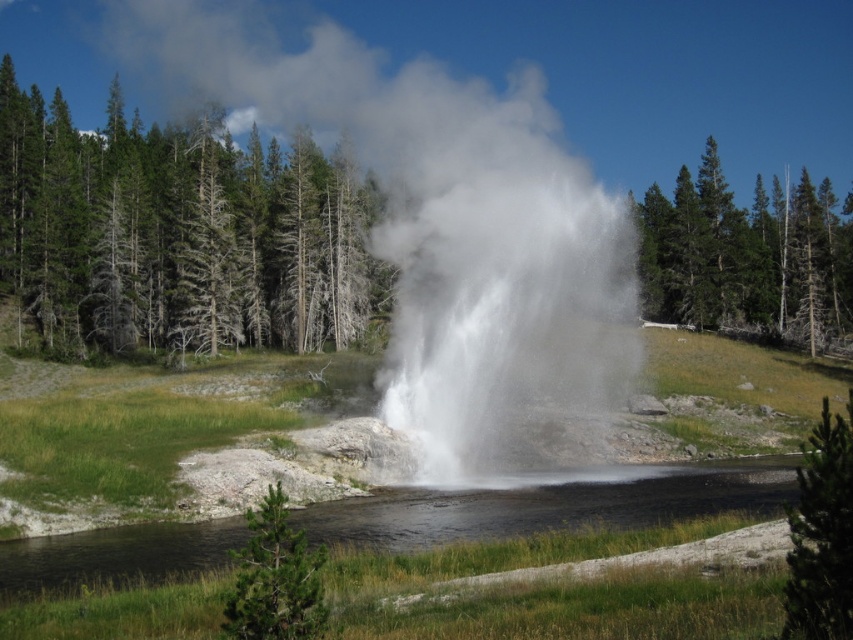
Can you confirm if white vapor at center is thinner than green leafy tree at upper right?

In fact, white vapor at center might be wider than green leafy tree at upper right.

Is white vapor at center to the right of green leafy tree at upper right from the viewer's perspective?

Incorrect, white vapor at center is not on the right side of green leafy tree at upper right.

Does point (454, 124) lie in front of point (677, 208)?

Yes, it is in front of point (677, 208).

Where is `white vapor at center`? This screenshot has height=640, width=853. white vapor at center is located at coordinates (448, 232).

Does white vapor at center have a lesser width compared to clear water at center?

In fact, white vapor at center might be wider than clear water at center.

In the scene shown: Can you confirm if white vapor at center is positioned above clear water at center?

Yes, white vapor at center is above clear water at center.

Is point (569, 276) positioned after point (204, 544)?

Yes, it is behind point (204, 544).

At what (x,y) coordinates should I click in order to perform the action: click on white vapor at center. Please return your answer as a coordinate pair (x, y). The width and height of the screenshot is (853, 640). Looking at the image, I should click on (448, 232).

Is point (244, 333) positioned before point (845, 616)?

No, (244, 333) is behind (845, 616).

Does point (61, 291) come farther from viewer compared to point (819, 611)?

Yes.

Which is in front, point (242, 268) or point (842, 449)?

Point (842, 449)

Where is `green coniferous trees at left`? The width and height of the screenshot is (853, 640). green coniferous trees at left is located at coordinates (178, 234).